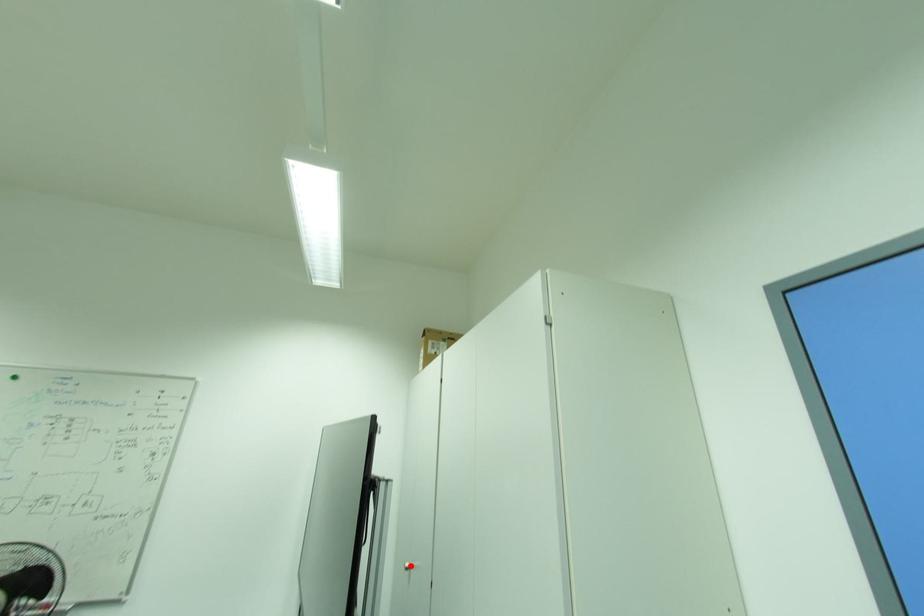
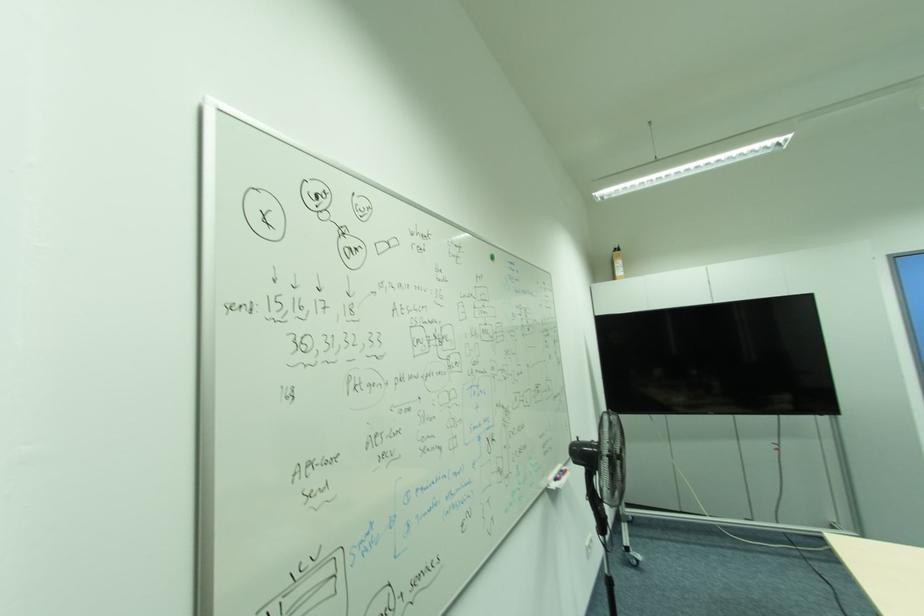
Question: I am providing you with two images of the same scene from different viewpoints. A red point is marked on the first image. At the location where the point appears in image 1, is it still visible in image 2?

Choices:
 (A) Yes
 (B) No

Answer: (B)